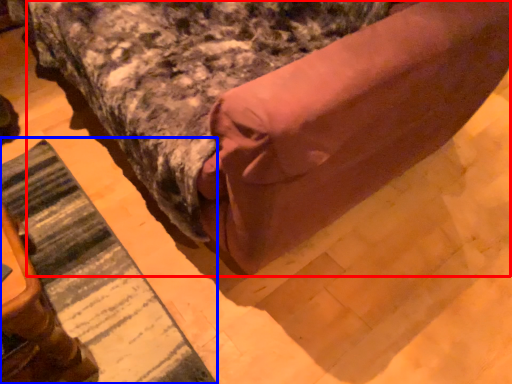
Question: Which object is further to the camera taking this photo, bed (highlighted by a red box) or mat (highlighted by a blue box)?

Choices:
 (A) bed
 (B) mat

Answer: (B)